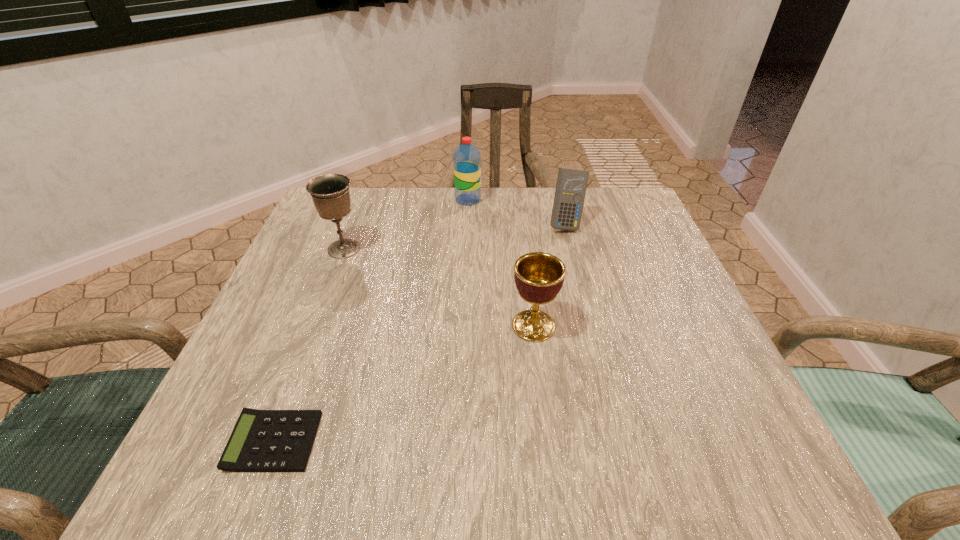
Identify which object is located as the second nearest to the shorter calculator. Please provide its 2D coordinates. Your answer should be formatted as a tuple, i.e. [(x, y)], where the tuple contains the x and y coordinates of a point satisfying the conditions above.

[(330, 193)]

Locate an element on the screen. free space that satisfies the following two spatial constraints: 1. on the front label of the farthest object; 2. on the front side of the farther chalice is located at coordinates (466, 249).

Locate an element on the screen. vacant space that satisfies the following two spatial constraints: 1. on the front label of the third object from right to left; 2. on the right side of the right chalice is located at coordinates (463, 326).

Find the location of a particular element. The width and height of the screenshot is (960, 540). free space that satisfies the following two spatial constraints: 1. on the front label of the farthest object; 2. on the front side of the nearer calculator is located at coordinates (458, 441).